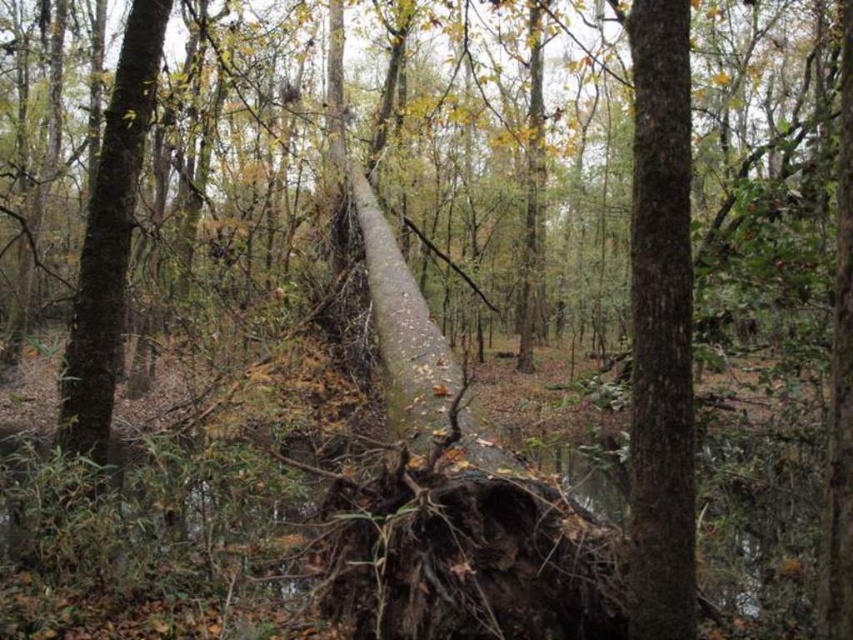
Is point (641, 289) positioned after point (103, 387)?

That is False.

Is smooth brown tree trunk at center above brown rough tree trunk at center?

No.

Is point (634, 380) more distant than point (119, 224)?

No.

Where is `smooth brown tree trunk at center`? smooth brown tree trunk at center is located at coordinates (660, 326).